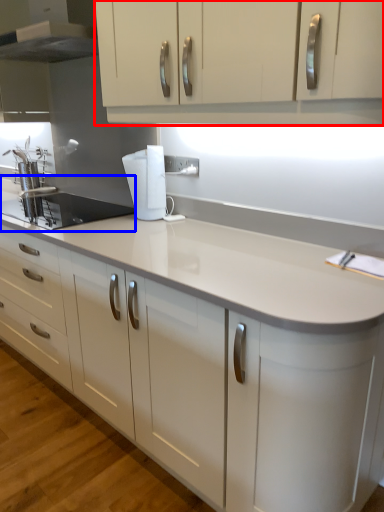
Question: Which of the following is the farthest to the observer, cabinetry (highlighted by a red box) or sink (highlighted by a blue box)?

Choices:
 (A) cabinetry
 (B) sink

Answer: (B)